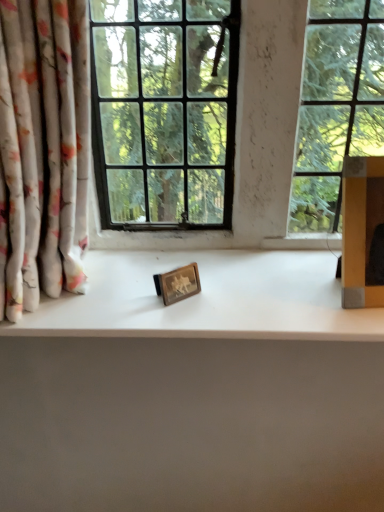
Question: Is yellow cardboard box at right to the left or to the right of wooden picture frame at center in the image?

Choices:
 (A) right
 (B) left

Answer: (A)

Question: In terms of width, does yellow cardboard box at right look wider or thinner when compared to wooden picture frame at center?

Choices:
 (A) wide
 (B) thin

Answer: (A)

Question: Which of these objects is positioned closest to the white matte counter top at center?

Choices:
 (A) floral fabric curtain at left
 (B) yellow cardboard box at right
 (C) wooden picture frame at center

Answer: (C)

Question: Which object is positioned farthest from the floral fabric curtain at left?

Choices:
 (A) yellow cardboard box at right
 (B) wooden picture frame at center
 (C) white matte counter top at center

Answer: (A)